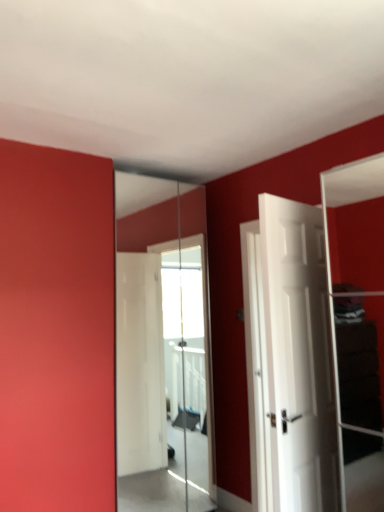
Question: Is white matte door at right inside or outside of clear glass mirror at center?

Choices:
 (A) outside
 (B) inside

Answer: (A)

Question: From the image's perspective, relative to clear glass mirror at center, is white matte door at right above or below?

Choices:
 (A) above
 (B) below

Answer: (A)

Question: Considering the positions of white matte door at right and clear glass mirror at center in the image, is white matte door at right wider or thinner than clear glass mirror at center?

Choices:
 (A) thin
 (B) wide

Answer: (B)

Question: Is clear glass mirror at center spatially inside white matte door at right, or outside of it?

Choices:
 (A) outside
 (B) inside

Answer: (A)

Question: In terms of width, does clear glass mirror at center look wider or thinner when compared to white matte door at right?

Choices:
 (A) thin
 (B) wide

Answer: (A)

Question: Considering their positions, is clear glass mirror at center located in front of or behind white matte door at right?

Choices:
 (A) behind
 (B) front

Answer: (A)

Question: In terms of size, does clear glass mirror at center appear bigger or smaller than white matte door at right?

Choices:
 (A) small
 (B) big

Answer: (B)